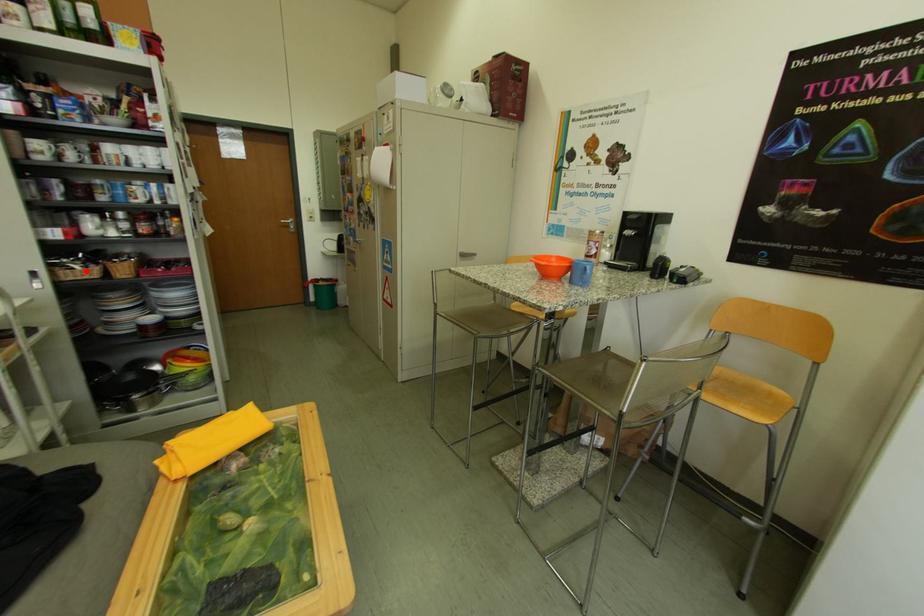
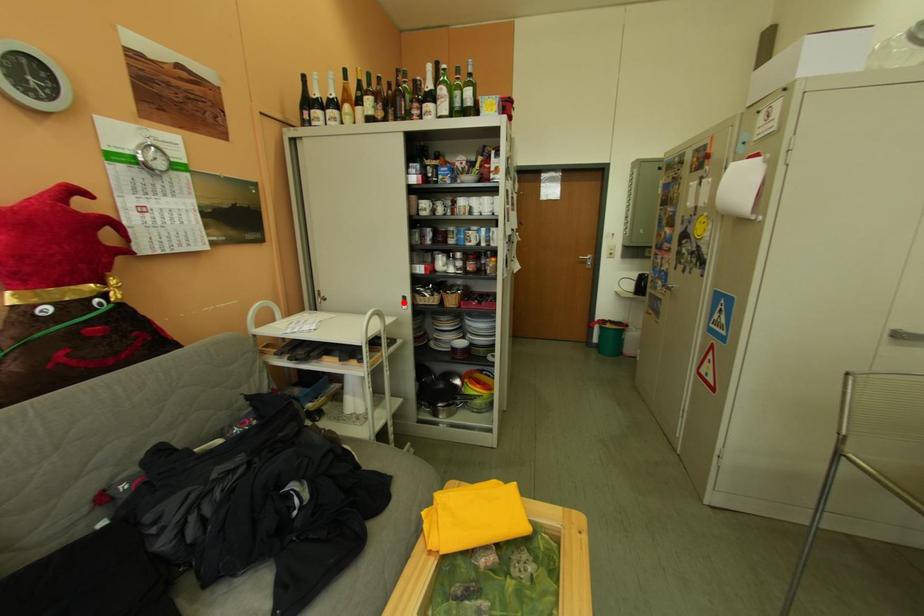
I am providing you with two images of the same scene from different viewpoints. A red point is marked on the first image and another point is marked on the second image. Does the point marked in image1 correspond to the same location as the one in image2?

No